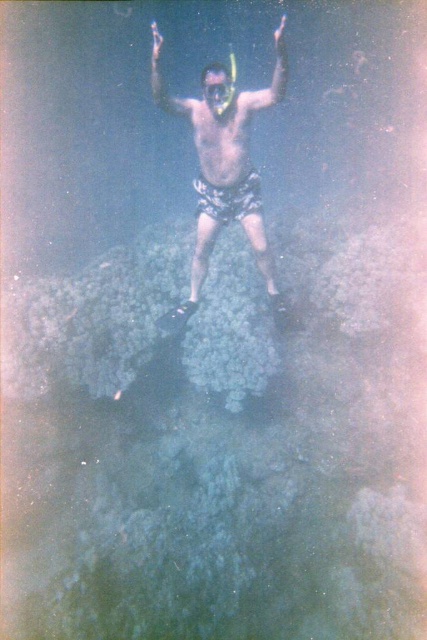
Question: Is smooth skin diver at center to the right of transparent plastic snorkel at upper center from the viewer's perspective?

Choices:
 (A) yes
 (B) no

Answer: (A)

Question: From the image, what is the correct spatial relationship of smooth skin diver at center in relation to transparent plastic snorkel at upper center?

Choices:
 (A) right
 (B) left

Answer: (A)

Question: Which object appears closest to the camera in this image?

Choices:
 (A) smooth skin diver at center
 (B) transparent plastic snorkel at upper center

Answer: (B)

Question: From the image, what is the correct spatial relationship of smooth skin diver at center in relation to transparent plastic snorkel at upper center?

Choices:
 (A) above
 (B) below

Answer: (B)